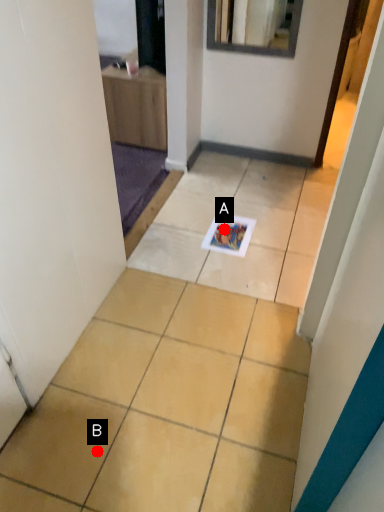
Question: Two points are circled on the image, labeled by A and B beside each circle. Among these points, which one is nearest to the camera?

Choices:
 (A) A is closer
 (B) B is closer

Answer: (B)